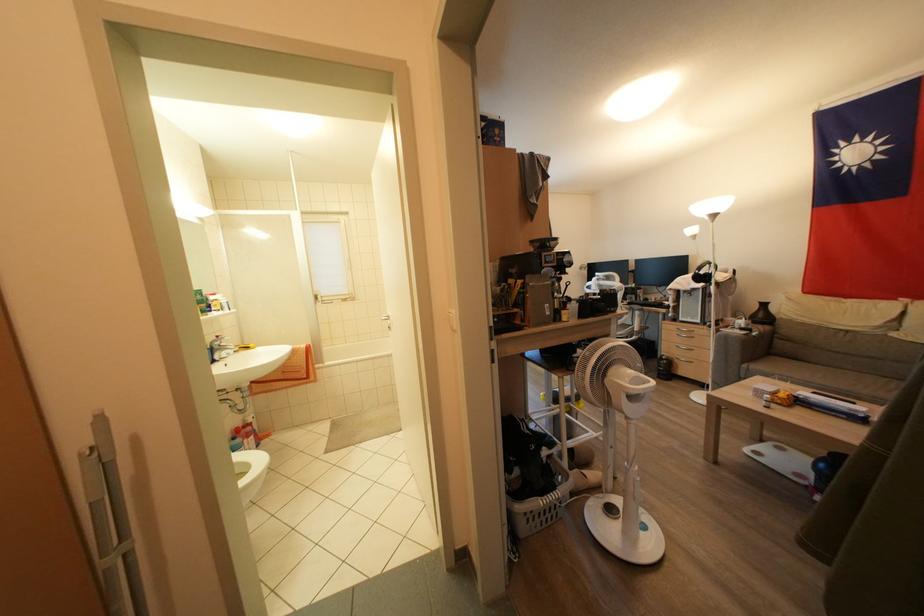
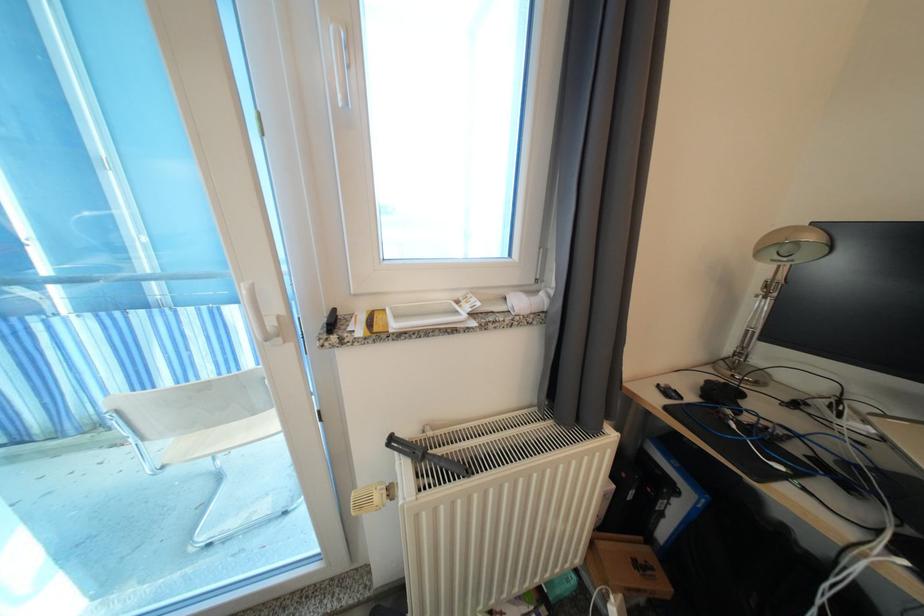
Question: Which direction would the cameraman need to move to produce the second image? Reply with the corresponding letter.

Choices:
 (A) Left
 (B) Right
 (C) Forward
 (D) Backward

Answer: (C)